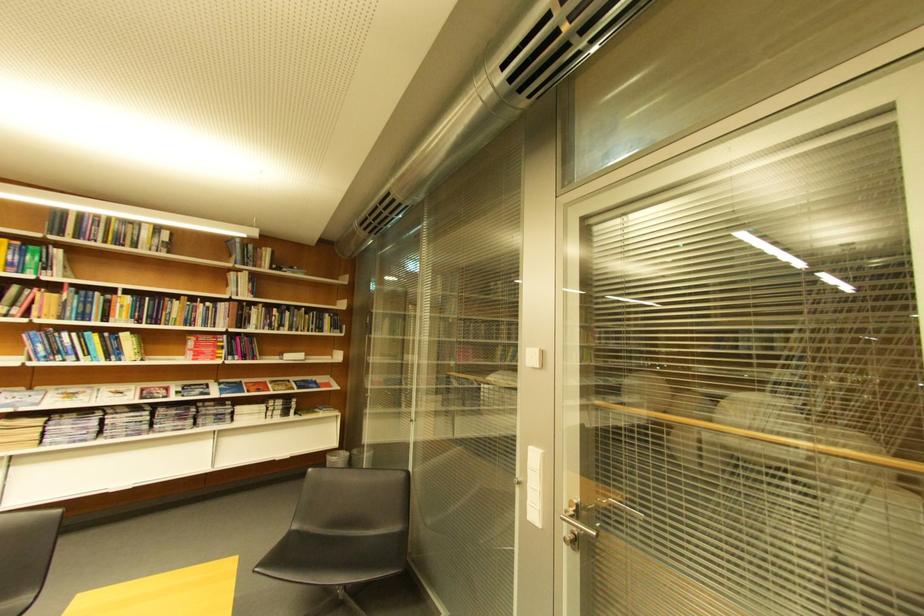
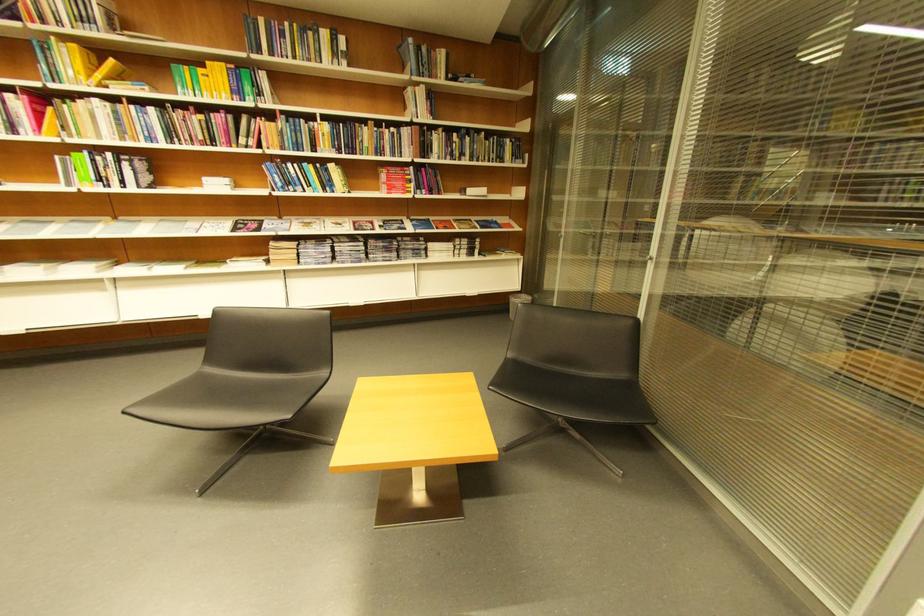
First-person continuous shooting, in which direction is the camera rotating?

The camera rotated toward left-down.